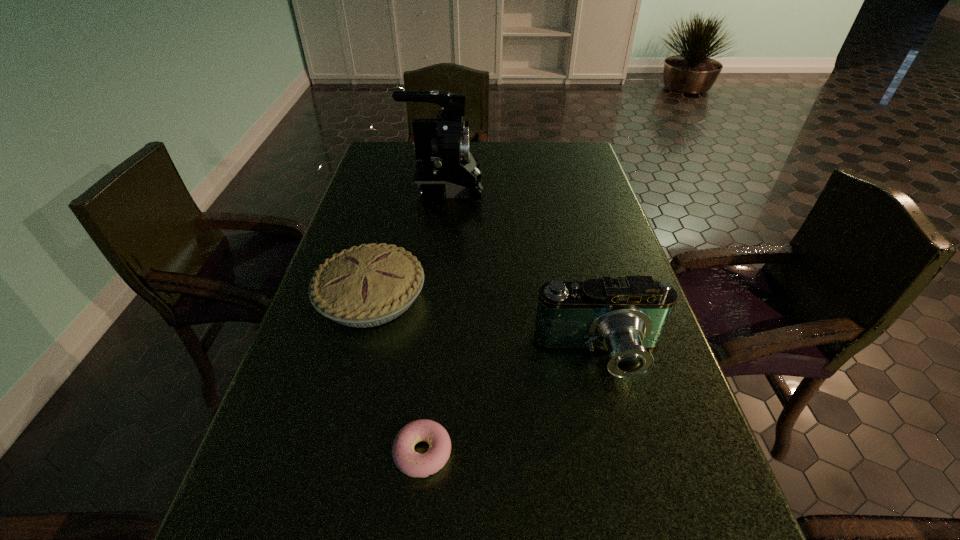
Locate an element on the screen. free space at the far right corner is located at coordinates (564, 144).

Find the location of a particular element. This screenshot has height=540, width=960. empty location between the shorter camcorder and the pie is located at coordinates (486, 327).

I want to click on empty space between the nearest object and the nearer camcorder, so click(512, 404).

Image resolution: width=960 pixels, height=540 pixels. In order to click on free space between the nearer camcorder and the farther camcorder in this screenshot , I will do `click(522, 272)`.

At what (x,y) coordinates should I click in order to perform the action: click on vacant region between the doughnut and the farther camcorder. Please return your answer as a coordinate pair (x, y). The width and height of the screenshot is (960, 540). Looking at the image, I should click on (433, 320).

I want to click on vacant area between the taller camcorder and the shortest object, so click(x=433, y=320).

Locate an element on the screen. Image resolution: width=960 pixels, height=540 pixels. free spot between the third tallest object and the tallest object is located at coordinates (407, 243).

Find the location of a particular element. This screenshot has height=540, width=960. vacant space in between the pie and the nearer camcorder is located at coordinates tap(486, 327).

Identify the location of empty space between the pie and the shortest object. (396, 375).

Find the location of a particular element. unoccupied position between the pie and the right camcorder is located at coordinates (486, 327).